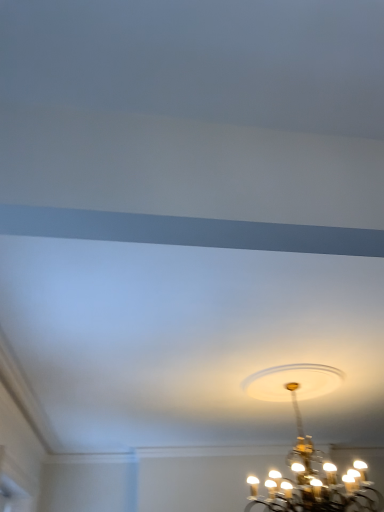
What do you see at coordinates (310, 449) in the screenshot? The width and height of the screenshot is (384, 512). I see `matte gold chandelier at center` at bounding box center [310, 449].

You are a GUI agent. You are given a task and a screenshot of the screen. Output one action in this format:
    pyautogui.click(x=<x>, y=<y>)
    Task: Click on the matte gold chandelier at center
    This screenshot has height=512, width=384.
    Given the screenshot: What is the action you would take?
    [310, 449]

In order to face matte gold chandelier at center, should I rotate leftwards or rightwards?

Turn right by 14.449 degrees to look at matte gold chandelier at center.

Measure the distance between matte gold chandelier at center and camera.

2.69 meters.

Locate an element on the screen. matte gold chandelier at center is located at coordinates (310, 449).